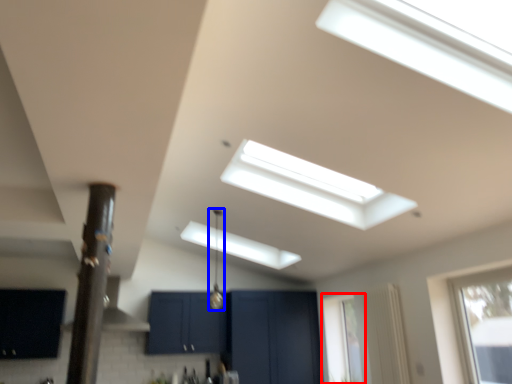
Question: Which object is closer to the camera taking this photo, window (highlighted by a red box) or light fixture (highlighted by a blue box)?

Choices:
 (A) window
 (B) light fixture

Answer: (B)